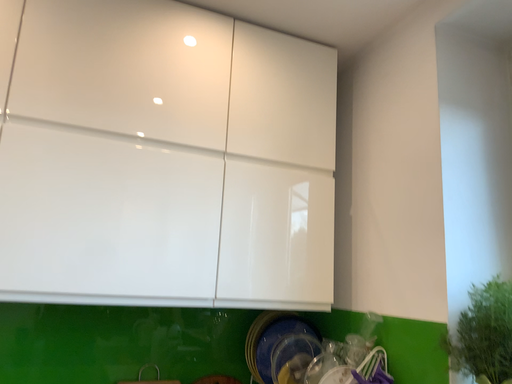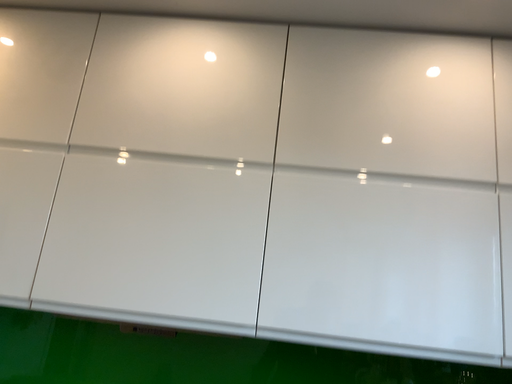
Question: How did the camera likely rotate when shooting the video?

Choices:
 (A) rotated right
 (B) rotated left

Answer: (B)